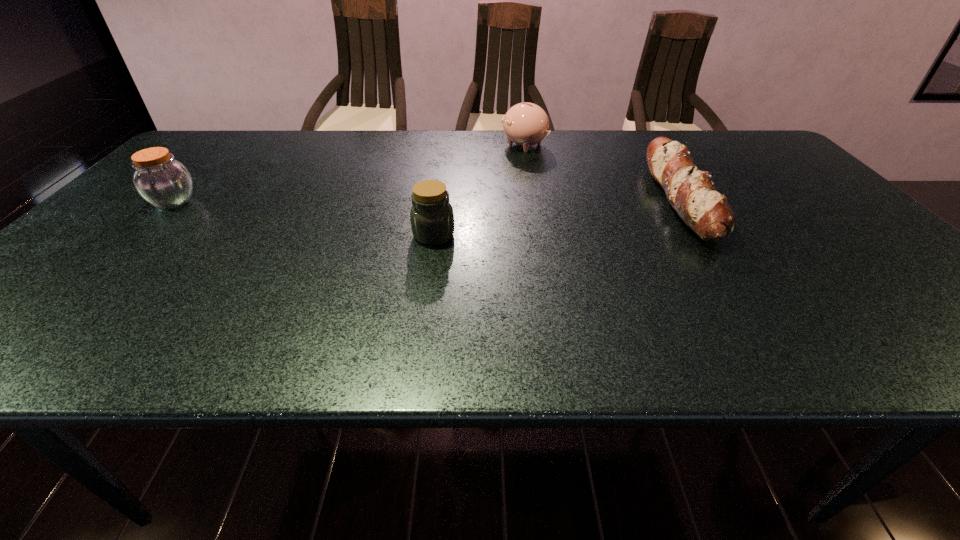
Locate an element on the screen. This screenshot has width=960, height=540. vacant space located 0.400m on the left of the second object from left to right is located at coordinates (244, 235).

Find the location of a particular element. This screenshot has height=540, width=960. vacant region located 0.070m on the left of the shortest object is located at coordinates (630, 200).

Locate an element on the screen. piggy bank present at the far edge is located at coordinates (526, 124).

Where is `baguet that is at the far edge`? The width and height of the screenshot is (960, 540). baguet that is at the far edge is located at coordinates (691, 192).

Locate an element on the screen. This screenshot has height=540, width=960. object situated at the left edge is located at coordinates (165, 183).

At what (x,y) coordinates should I click in order to perform the action: click on free space at the far edge of the desktop. Please return your answer as a coordinate pair (x, y). The height and width of the screenshot is (540, 960). Looking at the image, I should click on pos(487,138).

In the image, there is a desktop. Identify the location of free space at the near edge. Image resolution: width=960 pixels, height=540 pixels. (x=405, y=336).

Find the location of a particular element. The image size is (960, 540). blank space at the right edge is located at coordinates (925, 302).

The image size is (960, 540). In order to click on free space between the right jar and the leftmost object in this screenshot , I will do pyautogui.click(x=303, y=218).

Locate an element on the screen. This screenshot has width=960, height=540. unoccupied area between the farther jar and the third object from right to left is located at coordinates (303, 218).